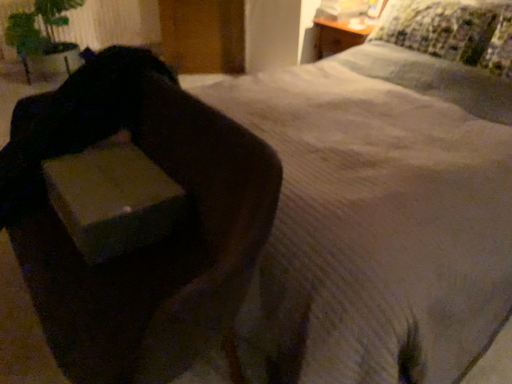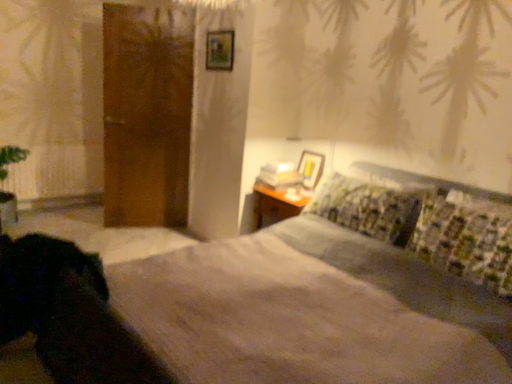
Question: How did the camera likely rotate when shooting the video?

Choices:
 (A) rotated left
 (B) rotated right

Answer: (B)